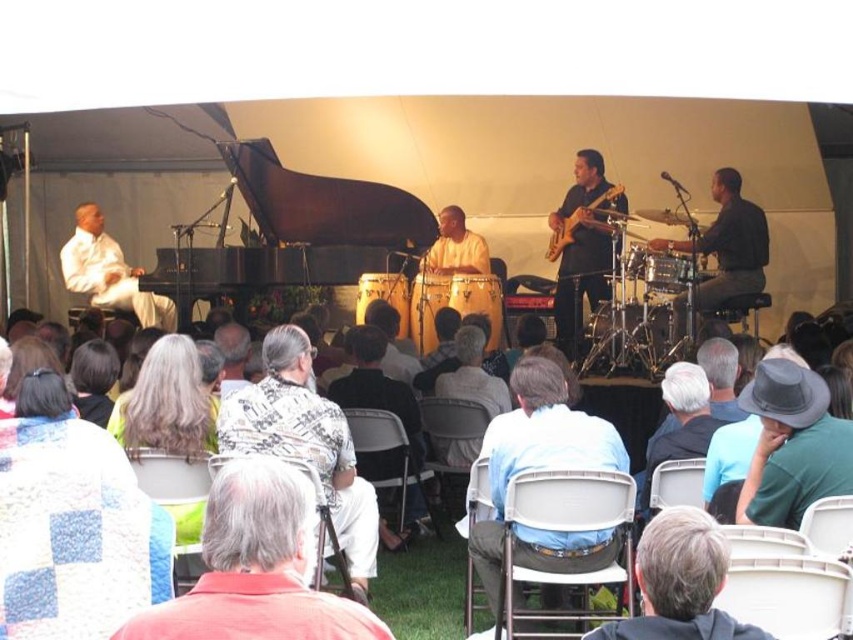
Question: Considering the relative positions of shiny black guitar at center and light brown leather jacket at center in the image provided, where is shiny black guitar at center located with respect to light brown leather jacket at center?

Choices:
 (A) above
 (B) below

Answer: (A)

Question: Which object is positioned closest to the dark brown polished piano at center?

Choices:
 (A) white silk shirt at left
 (B) smooth wooden drum at center
 (C) light blue shirt at center

Answer: (B)

Question: Does flannel shirt at center have a greater width compared to light brown leather jacket at center?

Choices:
 (A) no
 (B) yes

Answer: (B)

Question: Which of the following is the farthest from the observer?

Choices:
 (A) (474, 252)
 (B) (553, 234)
 (C) (270, 236)

Answer: (C)

Question: Does gray fabric hat at upper center have a greater width compared to light brown leather jacket at center?

Choices:
 (A) yes
 (B) no

Answer: (A)

Question: Which object is the farthest from the light blue shirt at center?

Choices:
 (A) matte black electric guitar at center
 (B) flannel shirt at center
 (C) light brown leather jacket at center

Answer: (A)